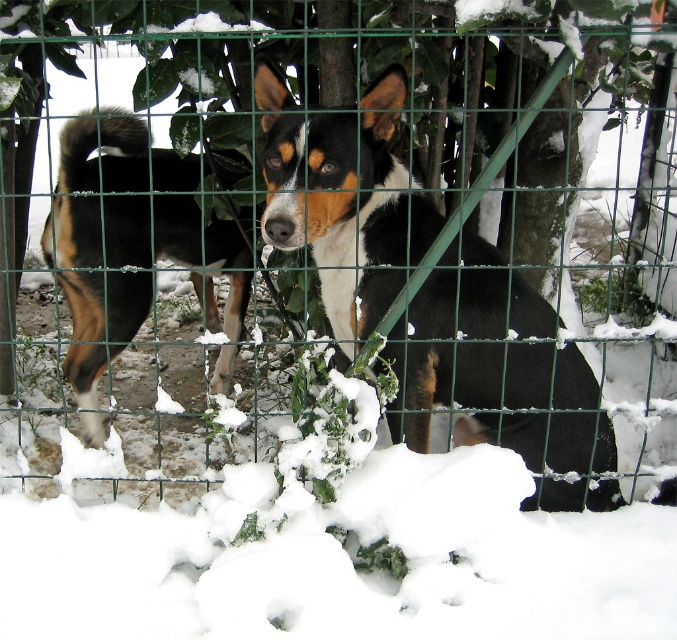
You are a photographer trying to capture both dogs in the image. Since the black and tan fur dog at center and the brown and white fur at center are partially hidden by the green wire fence, which dog is closer to the fence and thus more visible in your photo?

The black and tan fur dog at center is closer to the fence and therefore more visible in the photo because it is in front of the brown and white fur at center.

You are a photographer trying to capture both dogs in the frame. Given that your camera can only focus on objects wider than 30 cm, can you confirm if both the black and tan fur dog at center and the brown and white fur at center are within the focus range?

The black and tan fur dog at center is larger in width than the brown and white fur at center. Since the camera requires objects wider than 30 cm, the black and tan fur dog at center definitely meets the requirement. However, the brown and white fur at center might be narrower than 30 cm. Without knowing the exact width of the brown and white fur at center, we cannot confirm if both are within the focus range.

Based on the photo, based on the scene description, which dog is taller between the black and tan fur dog at center and the brown and white fur at center?

The black and tan fur dog at center is taller than the brown and white fur at center.